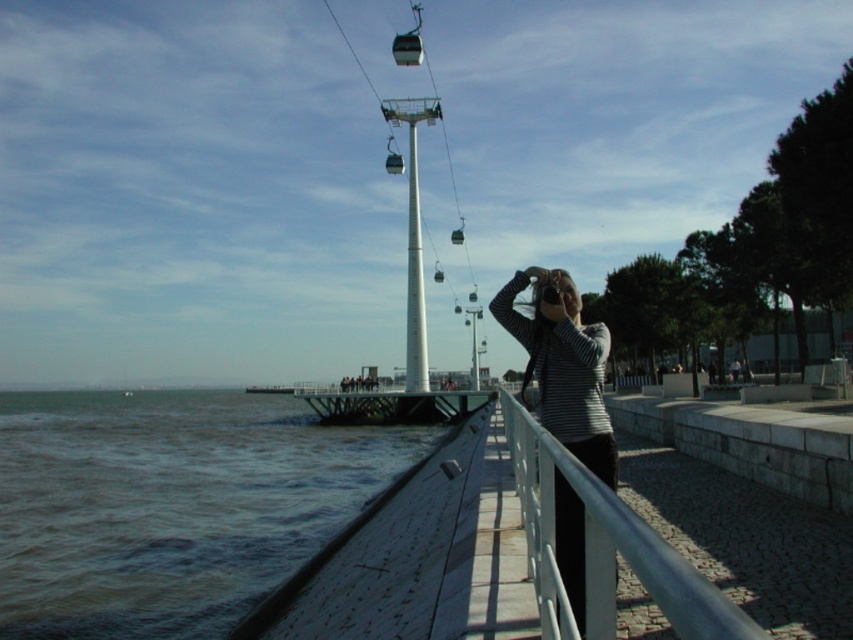
Question: Which of the following is the closest to the observer?

Choices:
 (A) white metal/rail at center
 (B) brown water at lower left
 (C) striped fabric at center

Answer: (A)

Question: Is brown water at lower left bigger than striped fabric at center?

Choices:
 (A) no
 (B) yes

Answer: (B)

Question: Among these objects, which one is farthest from the camera?

Choices:
 (A) brown water at lower left
 (B) white metal/rail at center
 (C) striped fabric at center

Answer: (A)

Question: Which point is farther from the camera taking this photo?

Choices:
 (A) (505, 392)
 (B) (578, 552)
 (C) (22, 572)

Answer: (A)

Question: In this image, where is brown water at lower left located relative to striped fabric at center?

Choices:
 (A) above
 (B) below

Answer: (B)

Question: Can you confirm if white metal/rail at center is smaller than striped fabric at center?

Choices:
 (A) no
 (B) yes

Answer: (B)